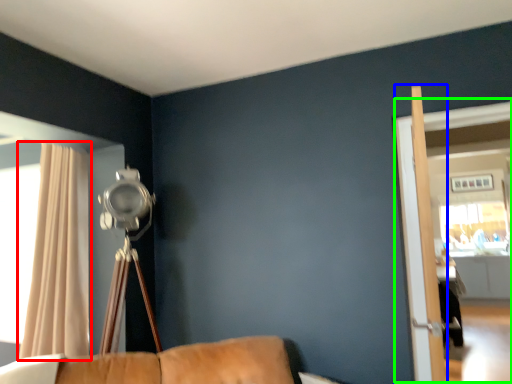
Question: Based on their relative distances, which object is nearer to curtain (highlighted by a red box)? Choose from screen door (highlighted by a blue box) and screen door (highlighted by a green box).

Choices:
 (A) screen door
 (B) screen door

Answer: (A)